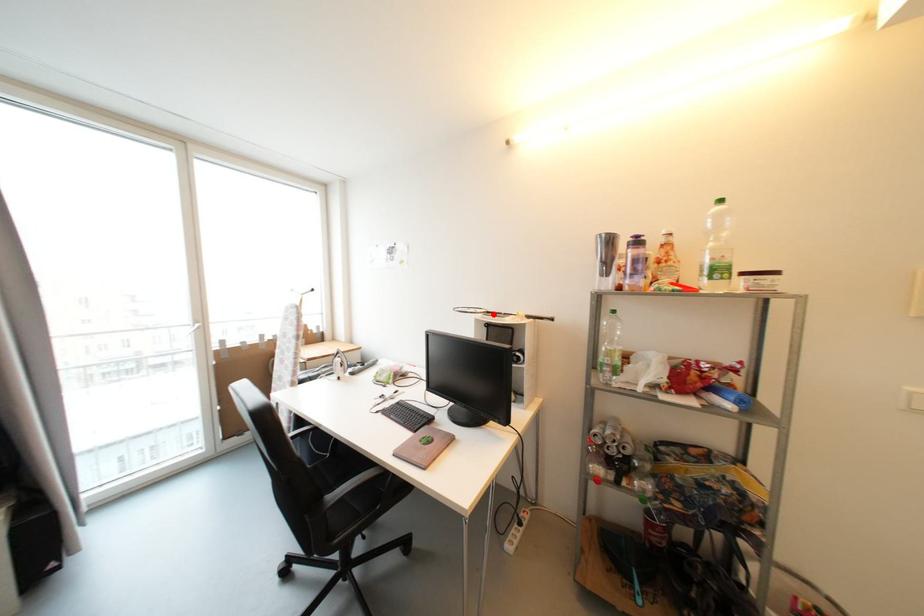
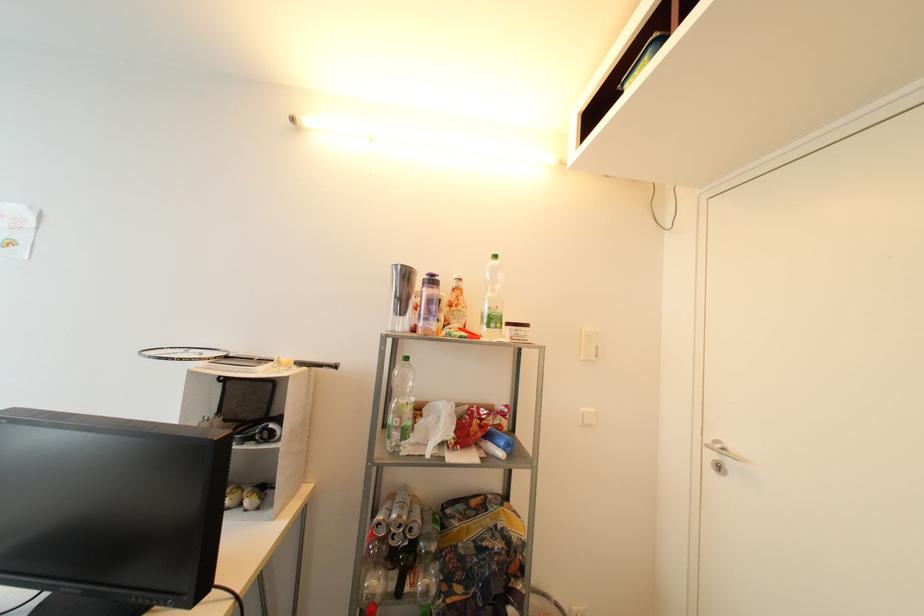
In the second image, find the point that corresponds to the highlighted location in the first image.

(232, 359)